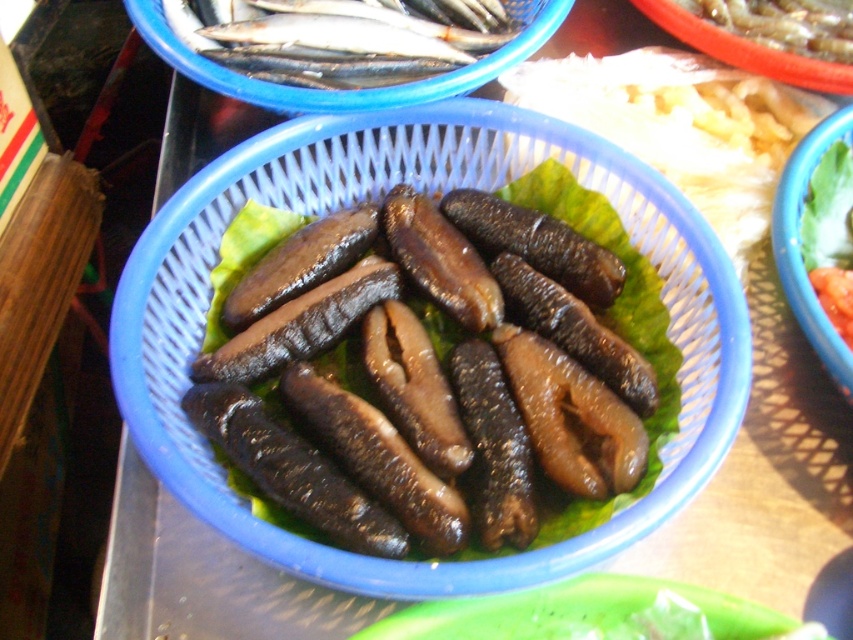
Question: Which of these objects is positioned closest to the black rubbery sea cucumber at center?

Choices:
 (A) shiny silver fish at upper center
 (B) black matte sea cucumber at center
 (C) blue plastic basket at upper center

Answer: (B)

Question: Is the position of black rubbery sea cucumber at center more distant than that of shiny silver fish at upper center?

Choices:
 (A) no
 (B) yes

Answer: (A)

Question: Is blue plastic basket at upper center bigger than black matte sea cucumber at center?

Choices:
 (A) yes
 (B) no

Answer: (A)

Question: Estimate the real-world distances between objects in this image. Which object is farther from the black rubbery sea cucumber at center?

Choices:
 (A) shiny silver fish at upper center
 (B) black matte sea cucumber at center

Answer: (A)

Question: Is black rubbery sea cucumber at center to the right of shiny silver fish at upper center from the viewer's perspective?

Choices:
 (A) yes
 (B) no

Answer: (A)

Question: Which object is farther from the camera taking this photo?

Choices:
 (A) black matte sea cucumber at center
 (B) blue plastic basket at upper center
 (C) shiny silver fish at upper center
 (D) black rubbery sea cucumber at center

Answer: (C)